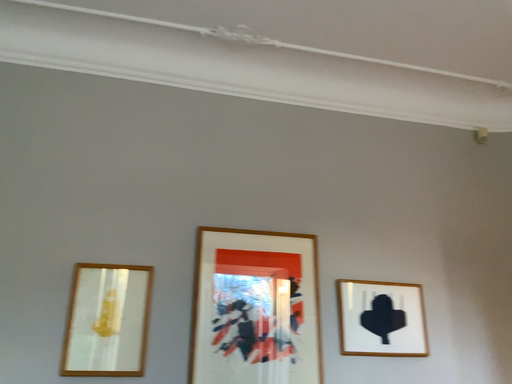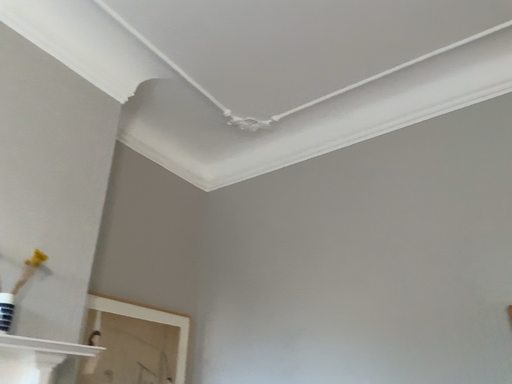
Question: How did the camera likely rotate when shooting the video?

Choices:
 (A) rotated left
 (B) rotated right

Answer: (A)